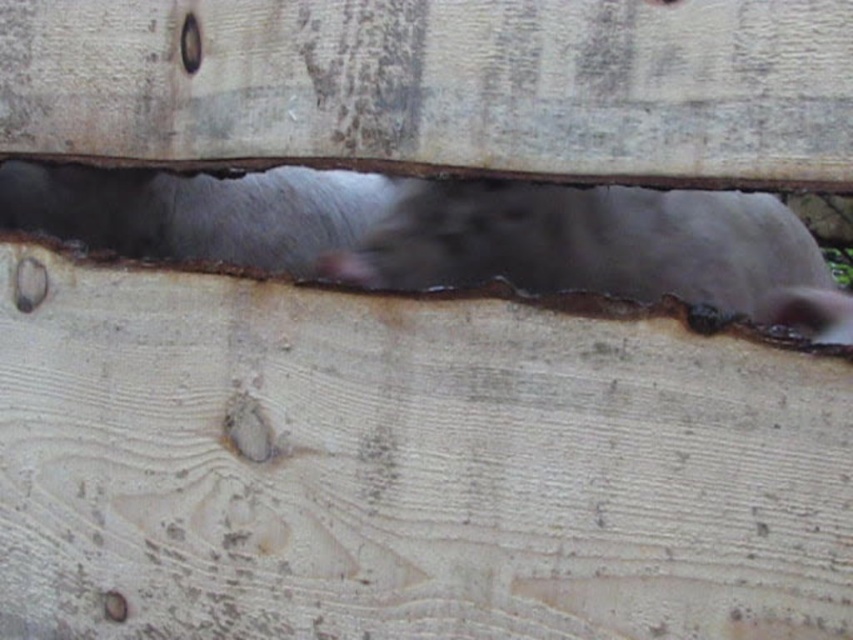
Question: Which of the following is the closest to the observer?

Choices:
 (A) (535, 120)
 (B) (714, 301)
 (C) (189, 35)

Answer: (A)

Question: Does gray matte animal at center lie in front of brushed metal hole at upper center?

Choices:
 (A) yes
 (B) no

Answer: (B)

Question: From the image, what is the correct spatial relationship of gray matte animal at center in relation to brushed metal hole at upper center?

Choices:
 (A) below
 (B) above

Answer: (A)

Question: Is smooth wood plank at center thinner than brushed metal hole at upper center?

Choices:
 (A) no
 (B) yes

Answer: (A)

Question: Which object is closer to the camera taking this photo?

Choices:
 (A) brushed metal hole at upper center
 (B) gray matte animal at center

Answer: (A)

Question: Which object is the closest to the brushed metal hole at upper center?

Choices:
 (A) smooth wood plank at center
 (B) gray matte animal at center

Answer: (A)